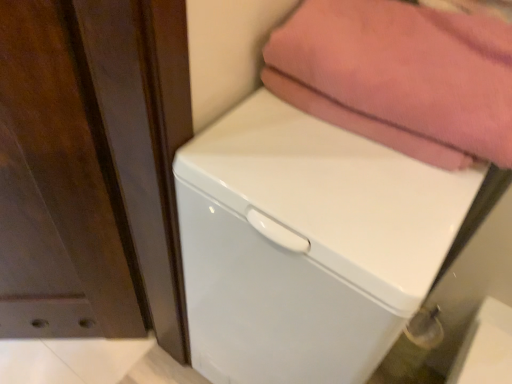
Question: Is white glossy dishwasher at center further to camera compared to pink cotton towel at upper right?

Choices:
 (A) no
 (B) yes

Answer: (A)

Question: Is white glossy dishwasher at center surrounding pink cotton towel at upper right?

Choices:
 (A) no
 (B) yes

Answer: (A)

Question: Is white glossy dishwasher at center wider than pink cotton towel at upper right?

Choices:
 (A) no
 (B) yes

Answer: (B)

Question: Are white glossy dishwasher at center and pink cotton towel at upper right beside each other?

Choices:
 (A) yes
 (B) no

Answer: (B)

Question: Does white glossy dishwasher at center appear on the left side of pink cotton towel at upper right?

Choices:
 (A) yes
 (B) no

Answer: (A)

Question: Does white glossy dishwasher at center have a smaller size compared to pink cotton towel at upper right?

Choices:
 (A) yes
 (B) no

Answer: (B)

Question: Is pink cotton towel at upper right further to camera compared to white glossy dishwasher at center?

Choices:
 (A) no
 (B) yes

Answer: (B)

Question: Are pink cotton towel at upper right and white glossy dishwasher at center making contact?

Choices:
 (A) no
 (B) yes

Answer: (A)

Question: Is pink cotton towel at upper right in front of white glossy dishwasher at center?

Choices:
 (A) no
 (B) yes

Answer: (A)

Question: Can you confirm if pink cotton towel at upper right is thinner than white glossy dishwasher at center?

Choices:
 (A) yes
 (B) no

Answer: (A)

Question: From a real-world perspective, is pink cotton towel at upper right beneath white glossy dishwasher at center?

Choices:
 (A) no
 (B) yes

Answer: (A)

Question: From the image's perspective, is pink cotton towel at upper right on top of white glossy dishwasher at center?

Choices:
 (A) no
 (B) yes

Answer: (B)

Question: Considering the positions of pink cotton towel at upper right and white glossy dishwasher at center in the image, is pink cotton towel at upper right wider or thinner than white glossy dishwasher at center?

Choices:
 (A) thin
 (B) wide

Answer: (A)